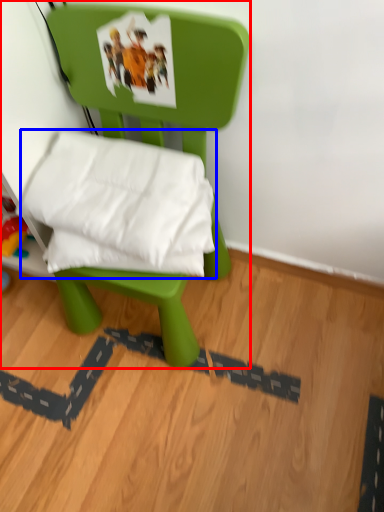
Question: Which point is closer to the camera, furniture (highlighted by a red box) or pillow (highlighted by a blue box)?

Choices:
 (A) furniture
 (B) pillow

Answer: (A)